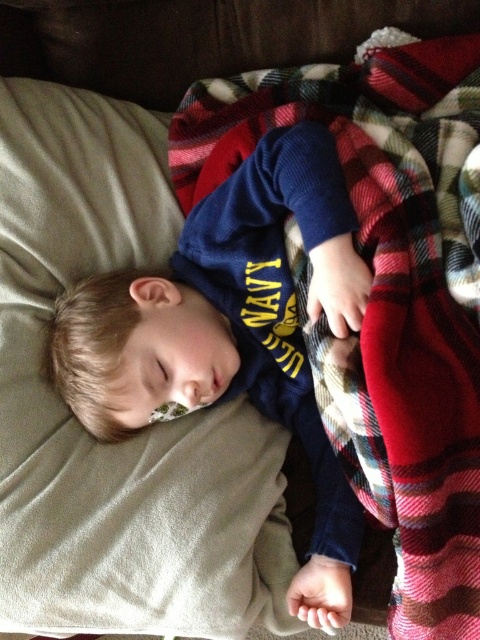
Question: From the image, what is the correct spatial relationship of plaid fabric blanket at upper right in relation to navy blue sweater at center?

Choices:
 (A) below
 (B) above

Answer: (B)

Question: Is plaid fabric blanket at upper right positioned in front of navy blue sweater at center?

Choices:
 (A) no
 (B) yes

Answer: (B)

Question: Which point is farther to the camera?

Choices:
 (A) (213, 262)
 (B) (419, 506)

Answer: (A)

Question: Is plaid fabric blanket at upper right smaller than navy blue sweater at center?

Choices:
 (A) no
 (B) yes

Answer: (A)